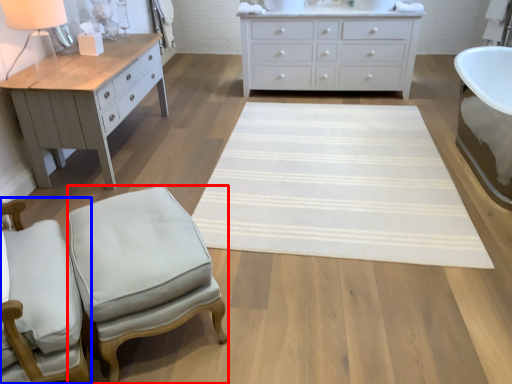
Question: Which object is further to the camera taking this photo, stool (highlighted by a red box) or chair (highlighted by a blue box)?

Choices:
 (A) stool
 (B) chair

Answer: (A)